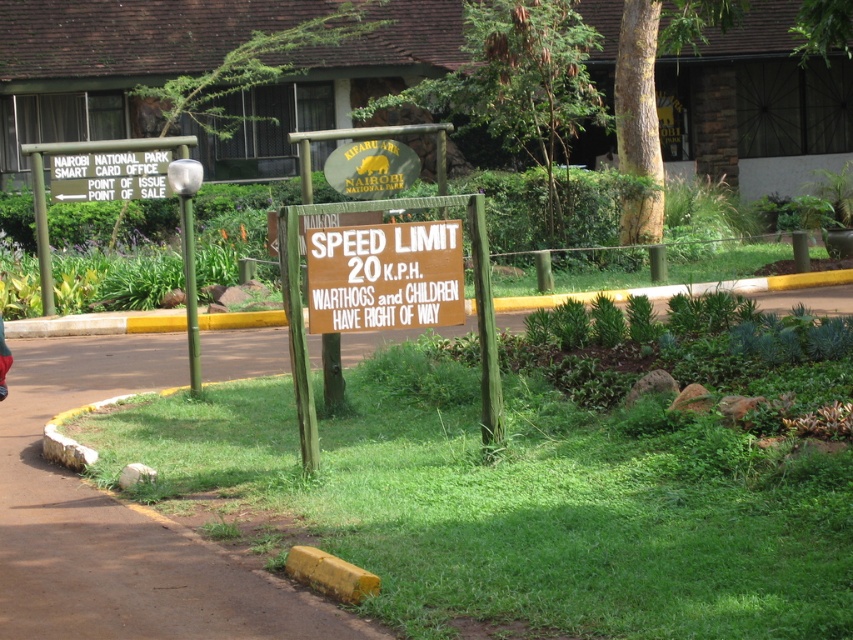
Question: Can you confirm if brown wooden sign at center is positioned above wooden signboard at center?

Choices:
 (A) no
 (B) yes

Answer: (A)

Question: Does brown wooden sign at center come in front of wooden signboard at center?

Choices:
 (A) yes
 (B) no

Answer: (A)

Question: Which point appears closest to the camera in this image?

Choices:
 (A) (340, 236)
 (B) (109, 198)

Answer: (A)

Question: Does brown wooden sign at center lie in front of wooden signboard at center?

Choices:
 (A) no
 (B) yes

Answer: (B)